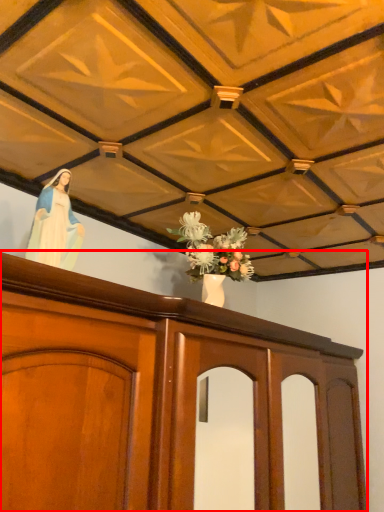
Question: Where is furniture (annotated by the red box) located in relation to woman in the image?

Choices:
 (A) right
 (B) left

Answer: (A)